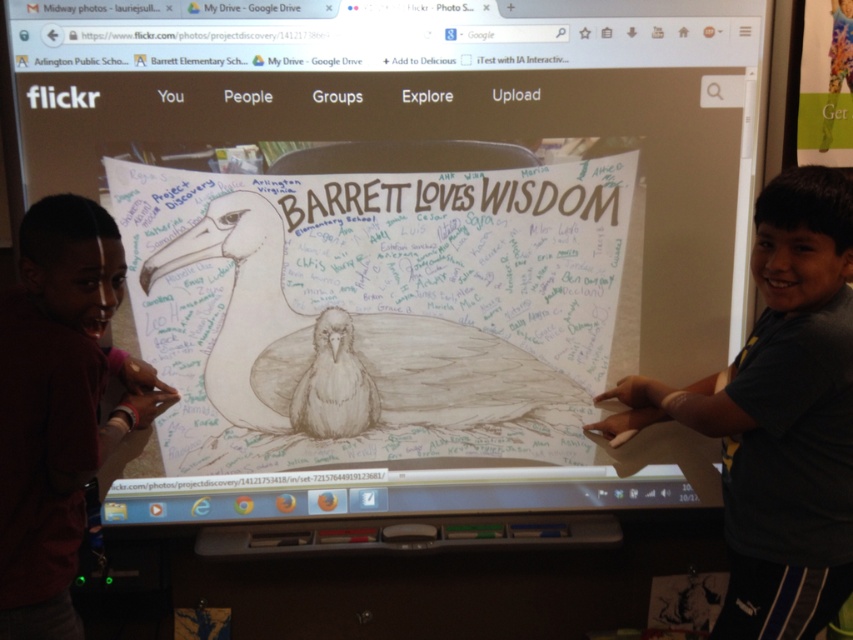
Question: Estimate the real-world distances between objects in this image. Which object is farther from the gray cotton shirt at right?

Choices:
 (A) white chalkboard writing at center
 (B) dark red shirt at left

Answer: (B)

Question: Which point is farther to the camera?

Choices:
 (A) white chalkboard writing at center
 (B) dark red shirt at left

Answer: (A)

Question: Can you confirm if gray cotton shirt at right is positioned above dark red shirt at left?

Choices:
 (A) no
 (B) yes

Answer: (B)

Question: Can you confirm if gray cotton shirt at right is positioned to the right of white chalkboard writing at center?

Choices:
 (A) yes
 (B) no

Answer: (A)

Question: Considering the real-world distances, which object is closest to the gray cotton shirt at right?

Choices:
 (A) white chalkboard writing at center
 (B) dark red shirt at left

Answer: (A)

Question: Does gray cotton shirt at right have a larger size compared to white chalkboard writing at center?

Choices:
 (A) yes
 (B) no

Answer: (A)